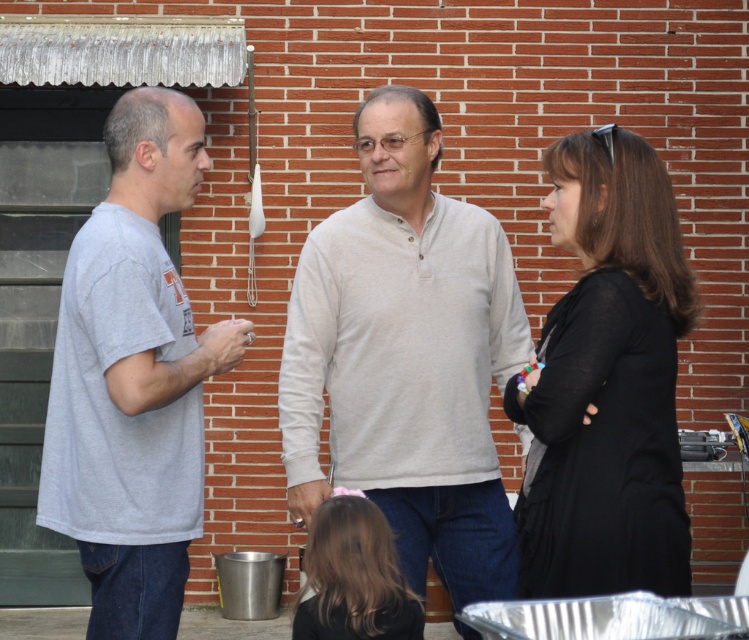
Consider the image. Can you confirm if light gray cotton shirt at center is positioned below smooth brown hair at lower center?

Actually, light gray cotton shirt at center is above smooth brown hair at lower center.

Is light gray cotton shirt at center wider than smooth brown hair at lower center?

Yes.

Is point (458, 557) in front of point (321, 568)?

No, it is not.

Image resolution: width=749 pixels, height=640 pixels. Find the location of `light gray cotton shirt at center`. light gray cotton shirt at center is located at coordinates (406, 356).

Does black matte coat at center right appear on the left side of smooth brown hair at lower center?

Incorrect, black matte coat at center right is not on the left side of smooth brown hair at lower center.

Who is taller, black matte coat at center right or smooth brown hair at lower center?

Standing taller between the two is black matte coat at center right.

Is point (658, 161) closer to camera compared to point (303, 632)?

Yes, it is in front of point (303, 632).

You are a GUI agent. You are given a task and a screenshot of the screen. Output one action in this format:
    pyautogui.click(x=<x>, y=<y>)
    Task: Click on the black matte coat at center right
    
    Given the screenshot: What is the action you would take?
    pyautogui.click(x=607, y=381)

Can you confirm if gray t-shirt at left is thinner than smooth brown hair at lower center?

No.

Does gray t-shirt at left come in front of smooth brown hair at lower center?

Yes.

The width and height of the screenshot is (749, 640). What do you see at coordinates (133, 378) in the screenshot?
I see `gray t-shirt at left` at bounding box center [133, 378].

Where is `gray t-shirt at left`? This screenshot has width=749, height=640. gray t-shirt at left is located at coordinates (133, 378).